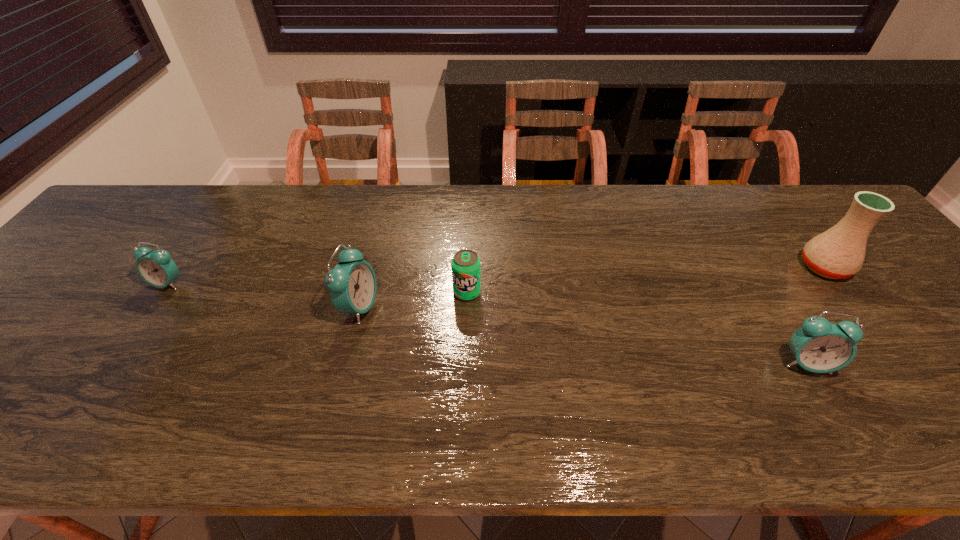
To ensure equal spacing by inserting another alarm_clock among them, please point out a vacant spot for this new alarm_clock. Please provide its 2D coordinates. Your answer should be formatted as a tuple, i.e. [(x, y)], where the tuple contains the x and y coordinates of a point satisfying the conditions above.

[(570, 334)]